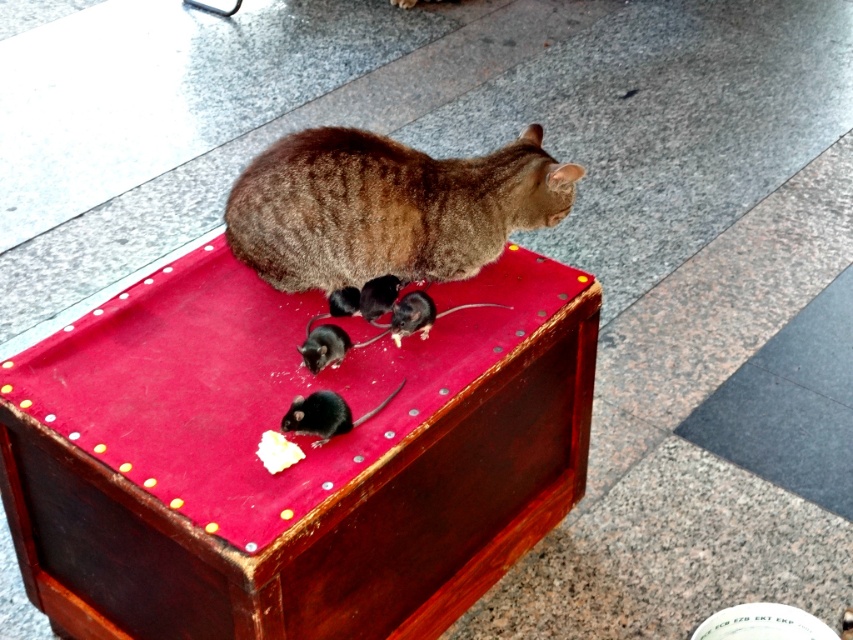
Question: Is brown fur cat at center in front of shiny black mouse at center?

Choices:
 (A) yes
 (B) no

Answer: (B)

Question: Which object appears farthest from the camera in this image?

Choices:
 (A) wooden stool at center
 (B) black matte mouse at center
 (C) brown fur cat at center

Answer: (C)

Question: Estimate the real-world distances between objects in this image. Which object is farther from the shiny black mouse at center?

Choices:
 (A) brown fur cat at center
 (B) black matte mouse at center
 (C) wooden stool at center

Answer: (A)

Question: Does brown fur cat at center have a smaller size compared to black matte mouse at center?

Choices:
 (A) yes
 (B) no

Answer: (B)

Question: Which object is farther from the camera taking this photo?

Choices:
 (A) wooden stool at center
 (B) black matte mouse at center
 (C) shiny black mouse at center
 (D) brown fur cat at center

Answer: (D)

Question: Is wooden stool at center to the right of shiny black mouse at center from the viewer's perspective?

Choices:
 (A) yes
 (B) no

Answer: (B)